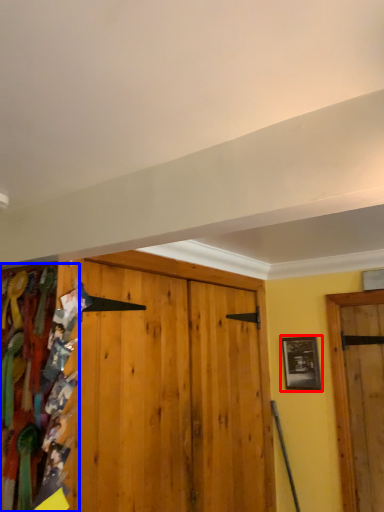
Question: Which of the following is the farthest to the observer, picture frame (highlighted by a red box) or textile (highlighted by a blue box)?

Choices:
 (A) picture frame
 (B) textile

Answer: (A)